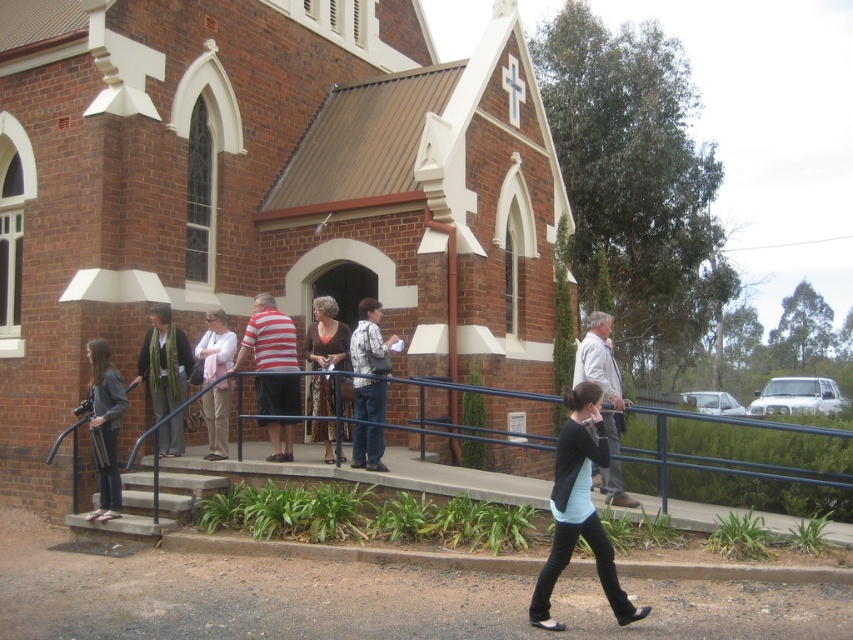
You are standing in front of the brick church and want to take a photo. You notice two points marked in the scene. The first point is at coordinates point (67, 1) and the second is at point (590, 349). Which of these two points is closer to your camera when taking the photo?

Point (67, 1) is closer to the camera than point (590, 349) because it is further to the camera according to the description.

You are standing at the point marked as point (260, 188). Based on the scene description, where are you located?

You are located on the brick church at center, as the point (260, 188) is on brick church at center.